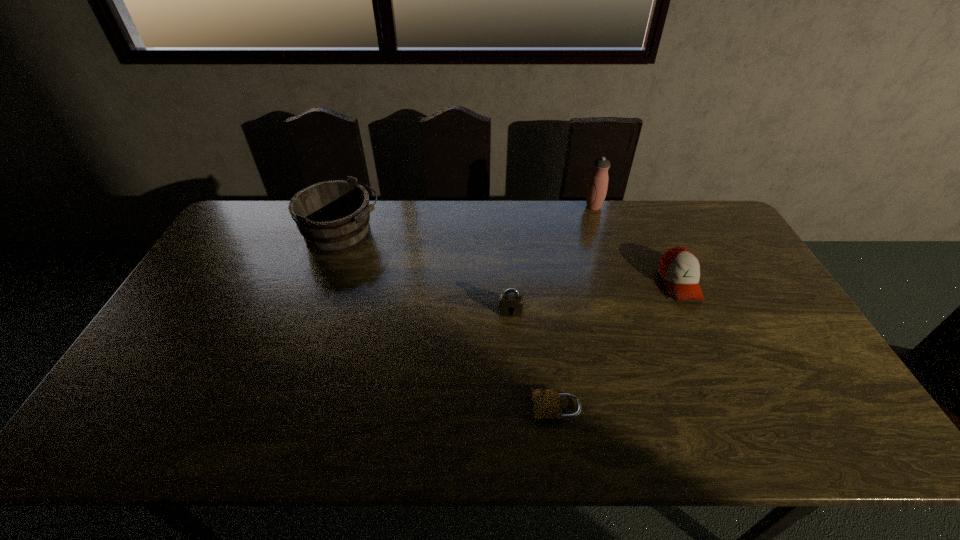
Locate an element on the screen. free space between the leftmost object and the farthest object is located at coordinates (468, 221).

Locate an element on the screen. This screenshot has height=540, width=960. free space that is in between the baseball cap and the leftmost object is located at coordinates (511, 260).

Identify the location of free space between the shorter padlock and the leftmost object. (449, 322).

Locate an element on the screen. free spot between the left padlock and the thermos bottle is located at coordinates (552, 259).

Locate an element on the screen. The width and height of the screenshot is (960, 540). the second closest object relative to the thermos bottle is located at coordinates (511, 302).

Locate which object is the second closest to the second tallest object. Please provide its 2D coordinates. Your answer should be formatted as a tuple, i.e. [(x, y)], where the tuple contains the x and y coordinates of a point satisfying the conditions above.

[(546, 402)]

I want to click on free location that satisfies the following two spatial constraints: 1. on the front-facing side of the baseball cap; 2. on the keyhole side of the shortest object, so click(x=736, y=408).

This screenshot has height=540, width=960. In order to click on blank space that satisfies the following two spatial constraints: 1. on the front-facing side of the rightmost object; 2. on the keyhole side of the shortest object in this screenshot , I will do `click(736, 408)`.